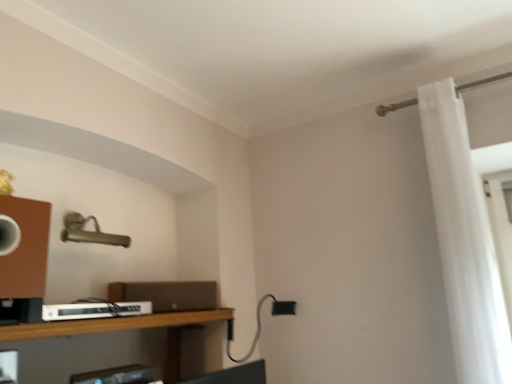
Question: From a real-world perspective, is wooden shelf at lower left above or below white plastic cable box at lower left?

Choices:
 (A) below
 (B) above

Answer: (A)

Question: Is wooden shelf at lower left inside or outside of white plastic cable box at lower left?

Choices:
 (A) outside
 (B) inside

Answer: (A)

Question: Which of these objects is positioned closest to the white sheer curtain at right?

Choices:
 (A) white plastic cable box at lower left
 (B) wooden shelf at lower left

Answer: (B)

Question: Estimate the real-world distances between objects in this image. Which object is farther from the white plastic cable box at lower left?

Choices:
 (A) wooden shelf at lower left
 (B) white sheer curtain at right

Answer: (B)